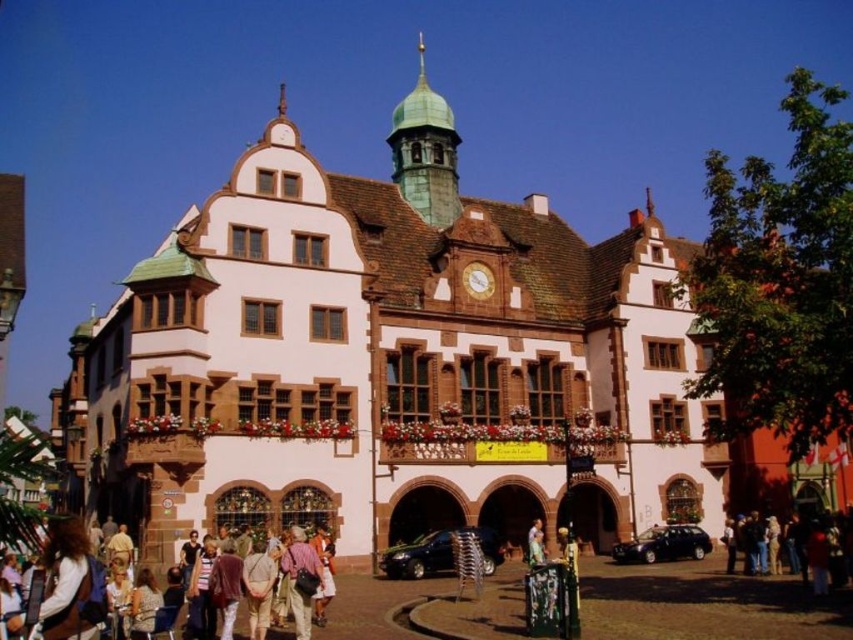
You are an architect designing a new building and want to ensure that the green copper bell tower at upper center and the light brown leather jacket at center are proportionate. Which object should you make wider to maintain balance?

To maintain balance, you should make the light brown leather jacket at center wider because the green copper bell tower at upper center is already wider than it.

You are standing in front of the European building and want to take a photo. You notice two points marked on the building facade. The first point is at coordinate point (428, 90) and the second is at coordinate point (532, 540). Which point is closer to your camera?

Point (428, 90) is further to the camera than point (532, 540), so the second point is closer to the camera.